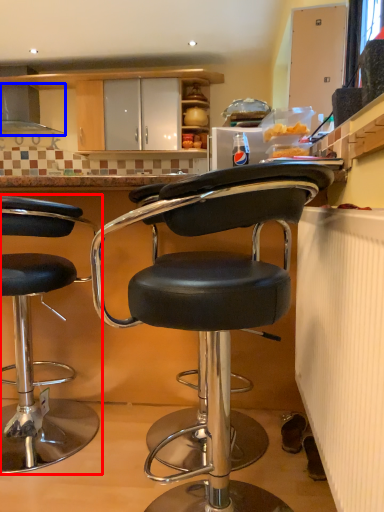
Question: Which point is further to the camera, chair (highlighted by a red box) or exhaust hood (highlighted by a blue box)?

Choices:
 (A) chair
 (B) exhaust hood

Answer: (B)